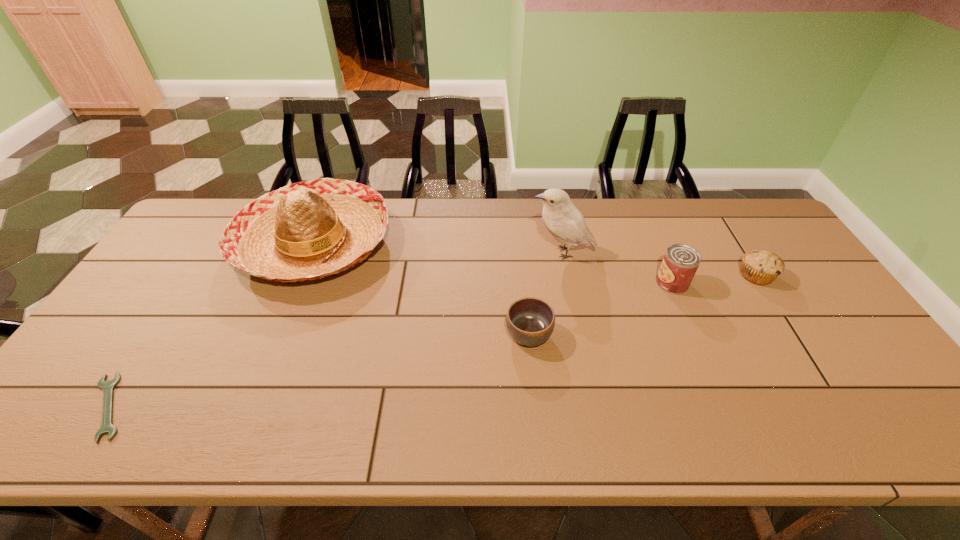
At what (x,y) coordinates should I click in order to perform the action: click on bird. Please return your answer as a coordinate pair (x, y). The width and height of the screenshot is (960, 540). Looking at the image, I should click on (564, 221).

Where is `the fifth shortest object`? The image size is (960, 540). the fifth shortest object is located at coordinates (309, 230).

Where is `the second object from left to right`? The image size is (960, 540). the second object from left to right is located at coordinates (309, 230).

The image size is (960, 540). I want to click on can, so click(680, 263).

Image resolution: width=960 pixels, height=540 pixels. I want to click on the fourth shortest object, so click(x=680, y=263).

You are a GUI agent. You are given a task and a screenshot of the screen. Output one action in this format:
    pyautogui.click(x=<x>, y=<y>)
    Task: Click on the muffin
    This screenshot has width=960, height=540.
    Given the screenshot: What is the action you would take?
    pyautogui.click(x=762, y=267)

Find the location of a particular element. This screenshot has height=540, width=960. bowl is located at coordinates (530, 321).

You are a GUI agent. You are given a task and a screenshot of the screen. Output one action in this format:
    pyautogui.click(x=<x>, y=<y>)
    Task: Click on the shortest object
    This screenshot has width=960, height=540.
    Given the screenshot: What is the action you would take?
    pyautogui.click(x=107, y=427)

Locate an element on the screen. This screenshot has height=540, width=960. the nearest object is located at coordinates (107, 427).

The width and height of the screenshot is (960, 540). I want to click on vacant region located at the beak of the tallest object, so click(x=465, y=253).